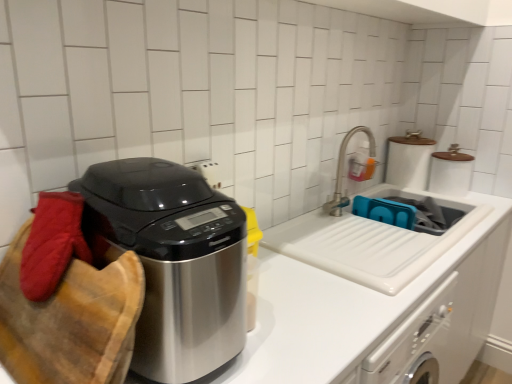
Measure the distance between polished stainless steel appliance at left and camera.

polished stainless steel appliance at left and camera are 26.12 inches apart from each other.

Locate an element on the screen. The image size is (512, 384). polished stainless steel appliance at left is located at coordinates tap(174, 261).

Does polished stainless steel appliance at left have a greater width compared to brushed metal faucet at upper right?

Correct, the width of polished stainless steel appliance at left exceeds that of brushed metal faucet at upper right.

What's the angular difference between polished stainless steel appliance at left and brushed metal faucet at upper right's facing directions?

They differ by 1.14 degrees in their facing directions.

From a real-world perspective, is polished stainless steel appliance at left positioned over brushed metal faucet at upper right based on gravity?

Indeed, from a real-world perspective, polished stainless steel appliance at left stands above brushed metal faucet at upper right.

Could brushed metal faucet at upper right be considered to be inside polished stainless steel appliance at left?

No, brushed metal faucet at upper right is located outside of polished stainless steel appliance at left.

Is blue plastic sink at center at the back of white glossy sink at center?

No, white glossy sink at center's orientation is not away from blue plastic sink at center.

From a real-world perspective, between white glossy sink at center and blue plastic sink at center, who is vertically lower?

In real-world perspective, white glossy sink at center is lower.

Is white glossy sink at center beside blue plastic sink at center?

There is a gap between white glossy sink at center and blue plastic sink at center.

From the image's perspective, between white glossy sink at center and blue plastic sink at center, which one is located above?

blue plastic sink at center appears higher in the image.

Is brushed metal faucet at upper right at the back of blue plastic sink at center?

No, blue plastic sink at center is not facing the opposite direction of brushed metal faucet at upper right.

What's the angular difference between blue plastic sink at center and brushed metal faucet at upper right's facing directions?

They differ by 0.00142 degrees in their facing directions.

Is blue plastic sink at center next to brushed metal faucet at upper right?

No, blue plastic sink at center is not beside brushed metal faucet at upper right.

Measure the distance between blue plastic sink at center and brushed metal faucet at upper right.

The distance of blue plastic sink at center from brushed metal faucet at upper right is 9.34 inches.

Is the position of polished stainless steel appliance at left less distant than that of white glossy sink at center?

Yes, it is.

Choose the correct answer: Is polished stainless steel appliance at left inside white glossy sink at center or outside it?

polished stainless steel appliance at left is spatially situated outside white glossy sink at center.

Does polished stainless steel appliance at left have a greater height compared to white glossy sink at center?

No.

In terms of width, does polished stainless steel appliance at left look wider or thinner when compared to white glossy sink at center?

polished stainless steel appliance at left is thinner than white glossy sink at center.

Is brushed metal faucet at upper right touching blue plastic sink at center?

No, brushed metal faucet at upper right is not making contact with blue plastic sink at center.

Is point (348, 136) behind point (409, 199)?

No, it is not.

This screenshot has height=384, width=512. In order to click on faucet that appears in front of the blue plastic sink at center in this screenshot , I will do `click(343, 171)`.

Is brushed metal faucet at upper right inside or outside of blue plastic sink at center?

brushed metal faucet at upper right is not inside blue plastic sink at center, it's outside.

From the image's perspective, is brushed metal faucet at upper right below polished stainless steel appliance at left?

Actually, brushed metal faucet at upper right appears above polished stainless steel appliance at left in the image.

Between brushed metal faucet at upper right and polished stainless steel appliance at left, which one has larger size?

polished stainless steel appliance at left.

Between brushed metal faucet at upper right and polished stainless steel appliance at left, which one has more height?

polished stainless steel appliance at left.

From the image's perspective, is polished stainless steel appliance at left beneath blue plastic sink at center?

Yes, from the image's perspective, polished stainless steel appliance at left is below blue plastic sink at center.

Image resolution: width=512 pixels, height=384 pixels. In order to click on sink below the polished stainless steel appliance at left (from a real-world perspective) in this screenshot , I will do `click(409, 211)`.

Looking at this image, which object is wider, polished stainless steel appliance at left or blue plastic sink at center?

Wider between the two is polished stainless steel appliance at left.

Does point (165, 344) come in front of point (387, 193)?

Yes, point (165, 344) is closer to viewer.

Locate an element on the screen. This screenshot has width=512, height=384. faucet behind the polished stainless steel appliance at left is located at coordinates tap(343, 171).

Where is `sink to the left of white glossy sink at center`? The width and height of the screenshot is (512, 384). sink to the left of white glossy sink at center is located at coordinates (409, 211).

Looking at the image, which one is located closer to brushed metal faucet at upper right, blue plastic sink at center or polished stainless steel appliance at left?

Among the two, blue plastic sink at center is located nearer to brushed metal faucet at upper right.

When comparing their distances from white glossy sink at center, does polished stainless steel appliance at left or blue plastic sink at center seem closer?

Among the two, blue plastic sink at center is located nearer to white glossy sink at center.

When comparing their distances from blue plastic sink at center, does brushed metal faucet at upper right or polished stainless steel appliance at left seem closer?

Based on the image, brushed metal faucet at upper right appears to be nearer to blue plastic sink at center.

Estimate the real-world distances between objects in this image. Which object is further from blue plastic sink at center, brushed metal faucet at upper right or white glossy sink at center?

white glossy sink at center is positioned further to the anchor blue plastic sink at center.

Estimate the real-world distances between objects in this image. Which object is further from polished stainless steel appliance at left, white glossy sink at center or blue plastic sink at center?

blue plastic sink at center is further to polished stainless steel appliance at left.

Considering their positions, is blue plastic sink at center positioned closer to polished stainless steel appliance at left than white glossy sink at center?

white glossy sink at center lies closer to polished stainless steel appliance at left than the other object.

Based on their spatial positions, is white glossy sink at center or polished stainless steel appliance at left closer to blue plastic sink at center?

Based on the image, white glossy sink at center appears to be nearer to blue plastic sink at center.

Based on their spatial positions, is white glossy sink at center or blue plastic sink at center further from brushed metal faucet at upper right?

white glossy sink at center lies further to brushed metal faucet at upper right than the other object.

This screenshot has height=384, width=512. Identify the location of faucet positioned between polished stainless steel appliance at left and blue plastic sink at center from near to far. (343, 171).

You are a GUI agent. You are given a task and a screenshot of the screen. Output one action in this format:
    pyautogui.click(x=<x>, y=<y>)
    Task: Click on the sink between brushed metal faucet at upper right and white glossy sink at center in the up-down direction
    The height and width of the screenshot is (384, 512).
    Given the screenshot: What is the action you would take?
    pyautogui.click(x=409, y=211)

This screenshot has height=384, width=512. Find the location of `counter between polished stainless steel appliance at left and blue plastic sink at center in the front-back direction`. counter between polished stainless steel appliance at left and blue plastic sink at center in the front-back direction is located at coordinates (379, 295).

What are the coordinates of `counter between polished stainless steel appliance at left and brushed metal faucet at upper right from front to back` in the screenshot? It's located at (379, 295).